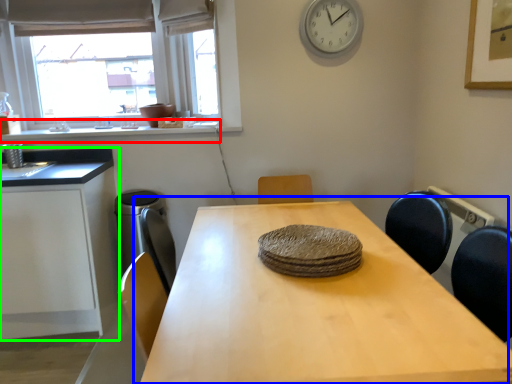
Question: Estimate the real-world distances between objects in this image. Which object is farther from window sill (highlighted by a red box), table (highlighted by a blue box) or cabinetry (highlighted by a green box)?

Choices:
 (A) table
 (B) cabinetry

Answer: (A)